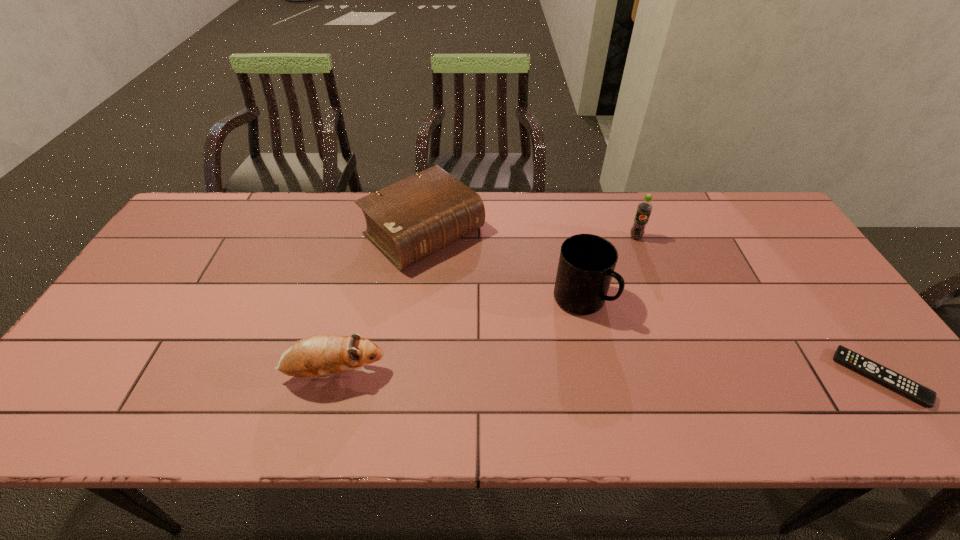
At what (x,y) coordinates should I click in order to perform the action: click on hamster. Please return your answer as a coordinate pair (x, y). The image size is (960, 540). Looking at the image, I should click on (318, 356).

You are a GUI agent. You are given a task and a screenshot of the screen. Output one action in this format:
    pyautogui.click(x=<x>, y=<y>)
    Task: Click on the remote control
    This screenshot has width=960, height=540.
    Given the screenshot: What is the action you would take?
    pyautogui.click(x=867, y=367)

I want to click on the rightmost object, so (867, 367).

Find the location of a particular element. This screenshot has height=540, width=960. Bible is located at coordinates (409, 220).

Locate an element on the screen. mug is located at coordinates (586, 266).

Locate an element on the screen. the third farthest object is located at coordinates (586, 266).

Where is `soda`? soda is located at coordinates (644, 208).

I want to click on vacant space located 0.210m at the face of the hamster, so click(x=477, y=374).

At what (x,y) coordinates should I click in order to perform the action: click on vacant space positioned 0.170m on the left of the shortest object. Please return your answer as a coordinate pair (x, y). The width and height of the screenshot is (960, 540). Looking at the image, I should click on (768, 378).

Find the location of a particular element. free space located 0.330m on the spine side of the Bible is located at coordinates (542, 337).